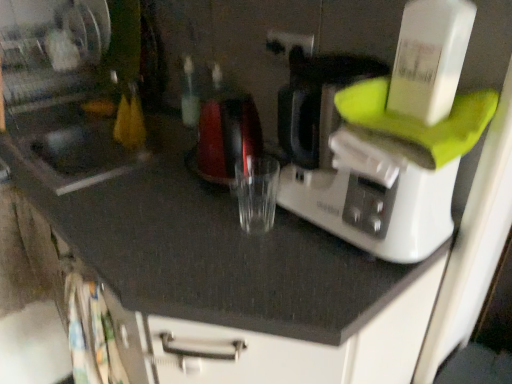
Question: Should I look upward or downward to see white plastic coffee maker at center?

Choices:
 (A) up
 (B) down

Answer: (A)